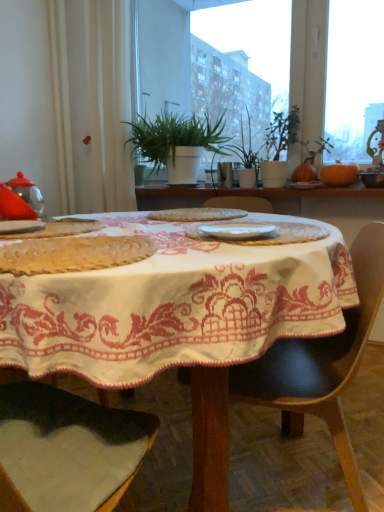
You are a GUI agent. You are given a task and a screenshot of the screen. Output one action in this format:
    pyautogui.click(x=<x>, y=<y>)
    Task: Click on the free location to the right of white matte plate at left, the second tableware positioned from the left
    The height and width of the screenshot is (512, 384).
    Given the screenshot: What is the action you would take?
    pyautogui.click(x=69, y=233)